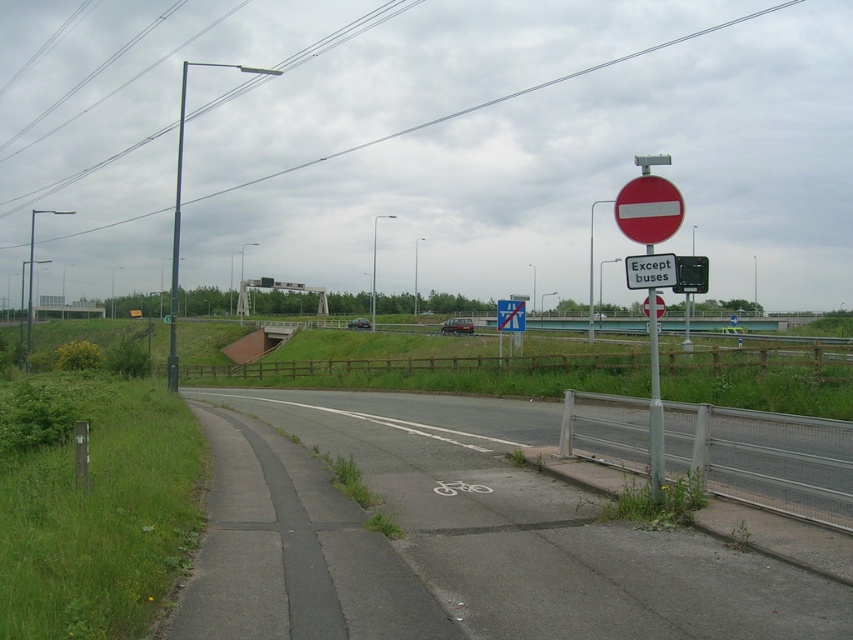
You are a delivery driver approaching the road with a truck. You see a metallic pole at upper right and a white plastic sign at upper center. Which object is wider from your perspective?

The metallic pole at upper right is wider than the white plastic sign at upper center.

You are a delivery driver who needs to pass through the area shown in the image. You see the metallic pole at upper right and the white plastic sign at upper center. How far apart are these two objects?

The metallic pole at upper right and the white plastic sign at upper center are 15.78 meters apart.